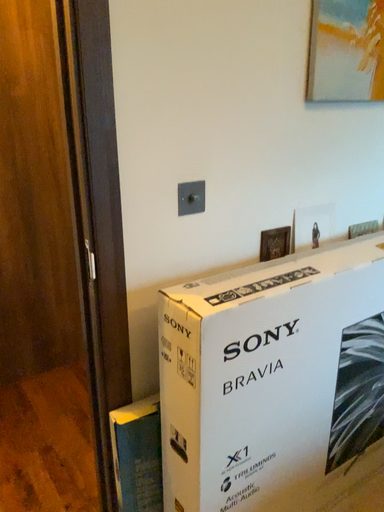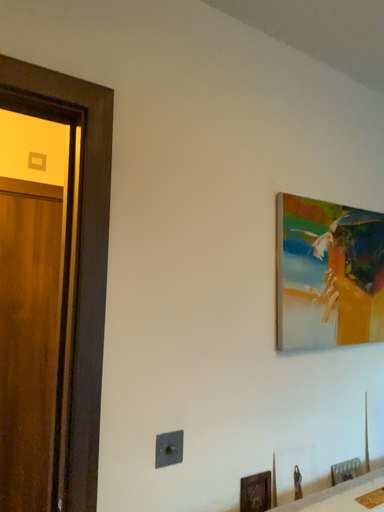
Question: How did the camera likely rotate when shooting the video?

Choices:
 (A) rotated downward
 (B) rotated upward

Answer: (B)